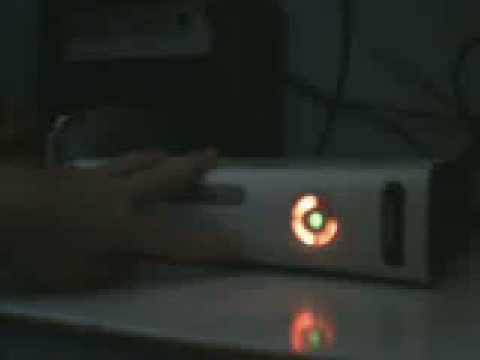
This screenshot has width=480, height=360. What are the coordinates of `table top` in the screenshot? It's located at (251, 314).